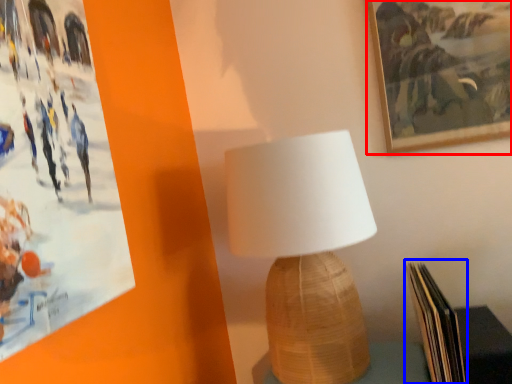
Question: Which of the following is the closest to the observer, picture frame (highlighted by a red box) or paperback book (highlighted by a blue box)?

Choices:
 (A) picture frame
 (B) paperback book

Answer: (B)